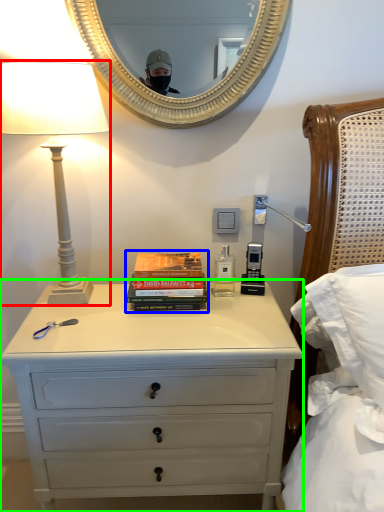
Question: Which object is the closest to the lamp (highlighted by a red box)? Choose among these: book (highlighted by a blue box) or chest of drawers (highlighted by a green box).

Choices:
 (A) book
 (B) chest of drawers

Answer: (A)